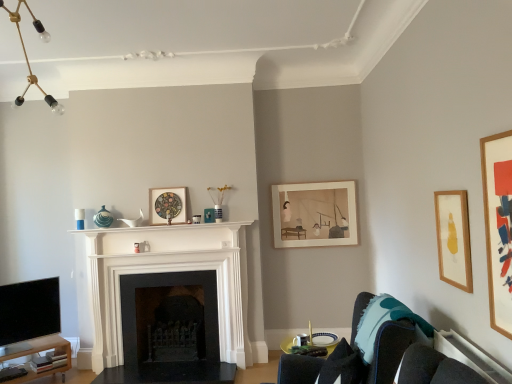
Question: Considering the positions of white marble fireplace at center, marked as the first fireplace in a front-to-back arrangement, and wooden picture frame at right, which is counted as the second picture frame, starting from the right, in the image, is white marble fireplace at center, marked as the first fireplace in a front-to-back arrangement, wider or thinner than wooden picture frame at right, which is counted as the second picture frame, starting from the right,?

Choices:
 (A) wide
 (B) thin

Answer: (A)

Question: From a real-world perspective, is white marble fireplace at center, marked as the first fireplace in a front-to-back arrangement, physically located above or below wooden picture frame at right, placed as the 4th picture frame when sorted from back to front?

Choices:
 (A) below
 (B) above

Answer: (A)

Question: Estimate the real-world distances between objects in this image. Which object is farther from the wooden picture frame at right, the 1th picture frame viewed from the front?

Choices:
 (A) white marble fireplace at center, which ranks as the second fireplace in back-to-front order
 (B) white glossy mantle at center
 (C) wooden picture frame at center, the 3th picture frame from the front
 (D) black marble table at center, the 1th table viewed from the right
 (E) matte paper picture frame at center-right, the second picture frame viewed from the left

Answer: (D)

Question: Which of these objects is positioned closest to the wooden picture frame at center, the 3th picture frame from the front?

Choices:
 (A) wooden picture frame at right, acting as the second picture frame starting from the front
 (B) white marble fireplace at center, marked as the first fireplace in a front-to-back arrangement
 (C) velvet dark blue couch at lower right
 (D) teal fabric pillow at lower right
 (E) matte paper picture frame at center-right, which is the first picture frame from back to front

Answer: (B)